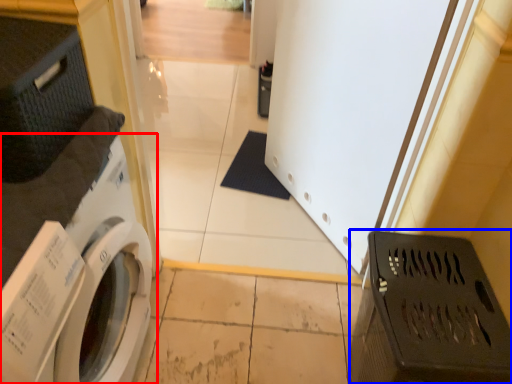
Question: Which of the following is the farthest to the observer, washing machine (highlighted by a red box) or laundry basket (highlighted by a blue box)?

Choices:
 (A) washing machine
 (B) laundry basket

Answer: (B)